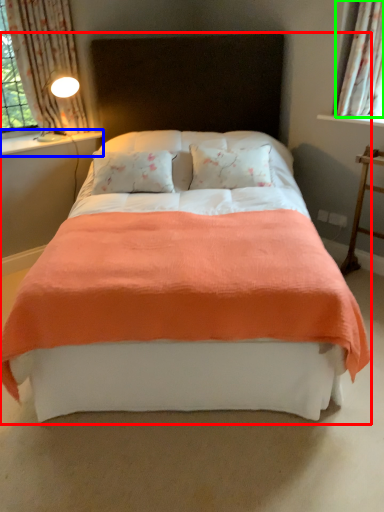
Question: Based on their relative distances, which object is nearer to bed (highlighted by a red box)? Choose from window sill (highlighted by a blue box) and curtain (highlighted by a green box).

Choices:
 (A) window sill
 (B) curtain

Answer: (B)